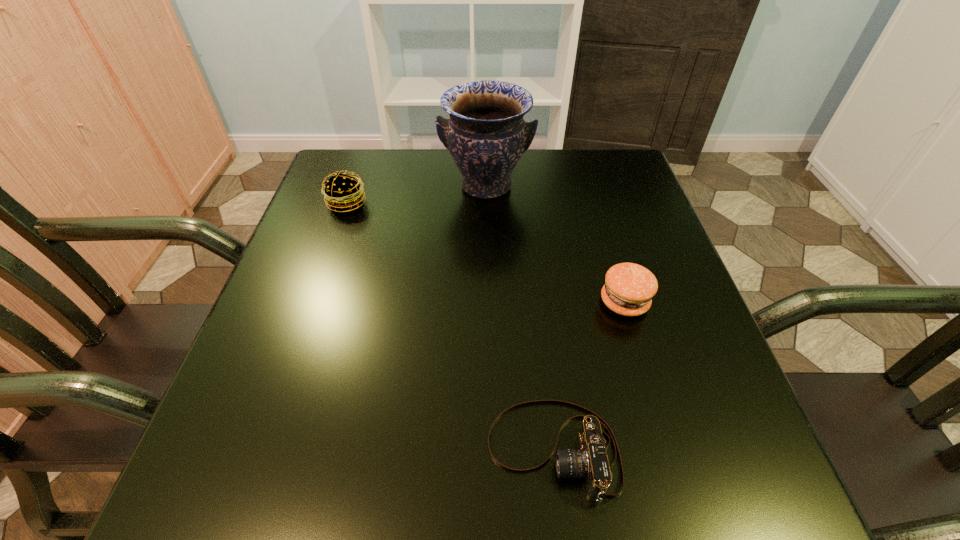
This screenshot has width=960, height=540. I want to click on free space that satisfies the following two spatial constraints: 1. on the front side of the second nearest object; 2. on the front-facing side of the camera, so click(669, 450).

Where is `blank space that satisfies the following two spatial constraints: 1. on the front handle of the second nearest object; 2. on the left side of the pottery`? This screenshot has width=960, height=540. blank space that satisfies the following two spatial constraints: 1. on the front handle of the second nearest object; 2. on the left side of the pottery is located at coordinates (488, 302).